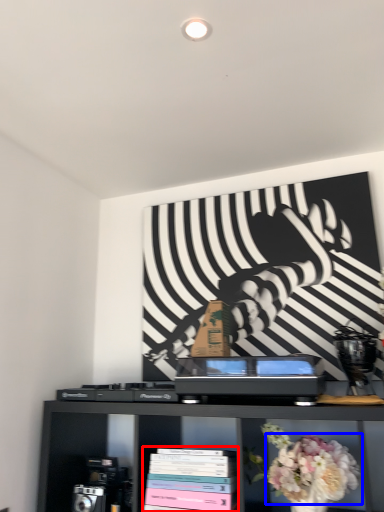
Question: Among these objects, which one is nearest to the camera, book (highlighted by a red box) or flower (highlighted by a blue box)?

Choices:
 (A) book
 (B) flower

Answer: (B)